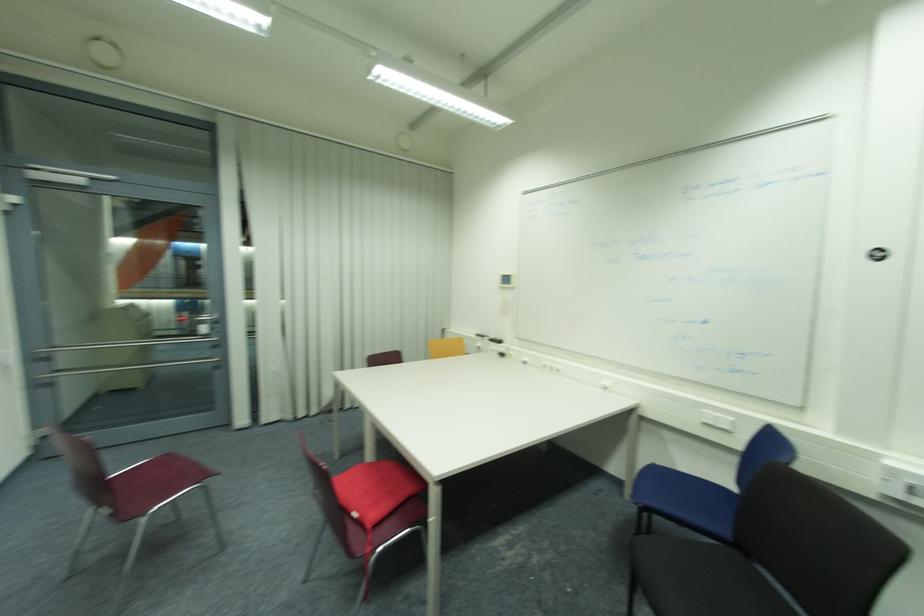
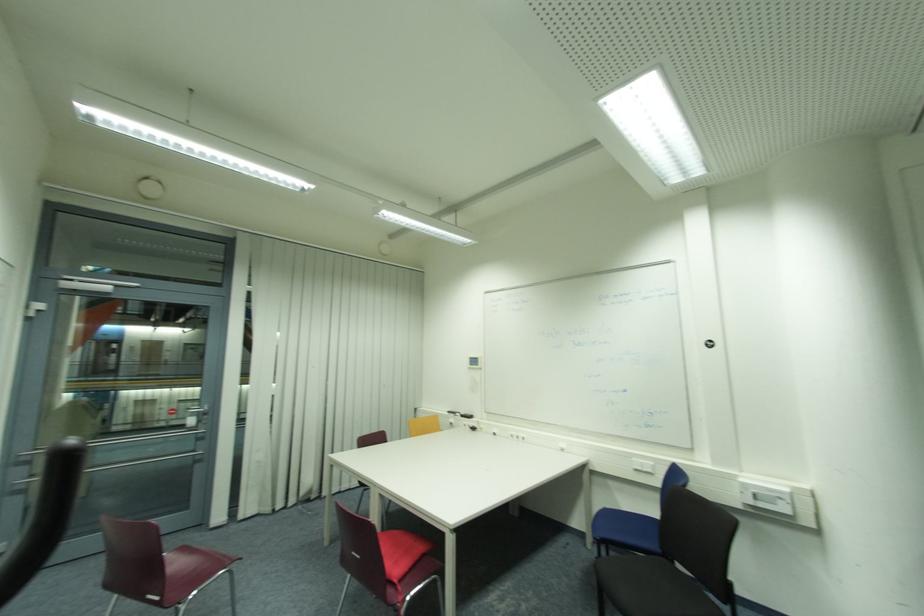
Question: The first image is from the beginning of the video and the second image is from the end. How did the camera likely rotate when shooting the video?

Choices:
 (A) Left
 (B) Right
 (C) Up
 (D) Down

Answer: (C)